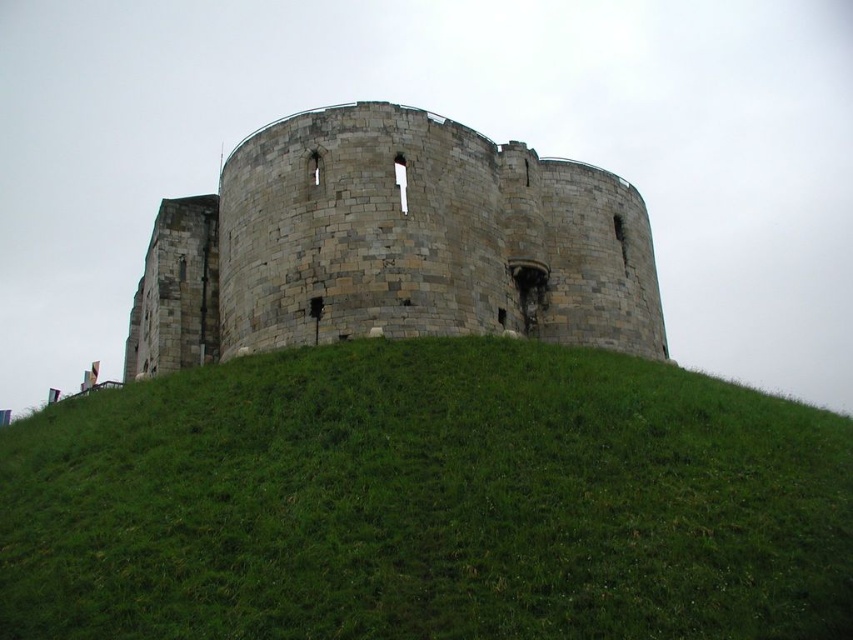
Question: Which point is closer to the camera?

Choices:
 (A) stone castle at center
 (B) green grassy hill at center

Answer: (B)

Question: Does green grassy hill at center appear on the right side of stone castle at center?

Choices:
 (A) yes
 (B) no

Answer: (A)

Question: Is green grassy hill at center smaller than stone castle at center?

Choices:
 (A) yes
 (B) no

Answer: (A)

Question: Which of the following is the farthest from the observer?

Choices:
 (A) green grassy hill at center
 (B) stone castle at center

Answer: (B)

Question: Among these objects, which one is farthest from the camera?

Choices:
 (A) green grassy hill at center
 (B) stone castle at center

Answer: (B)

Question: Is green grassy hill at center to the right of stone castle at center from the viewer's perspective?

Choices:
 (A) no
 (B) yes

Answer: (B)